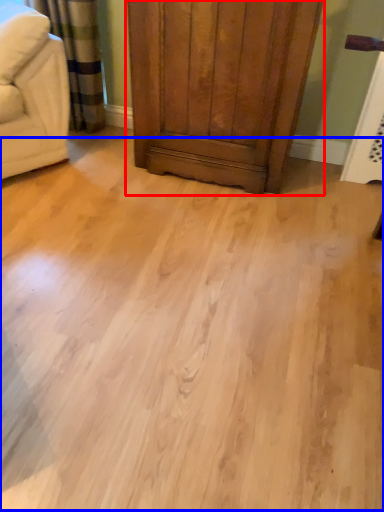
Question: Which object is further to the camera taking this photo, dresser (highlighted by a red box) or plain (highlighted by a blue box)?

Choices:
 (A) dresser
 (B) plain

Answer: (A)